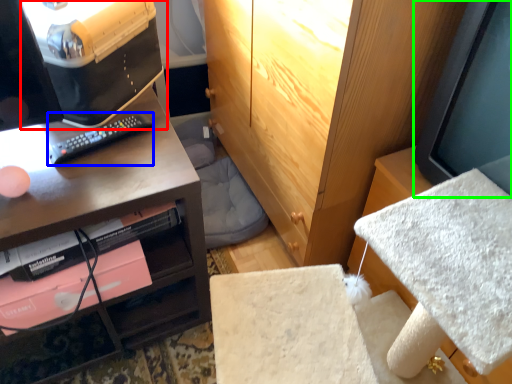
Question: Which object is the closest to the desktop computer (highlighted by a red box)? Choose among these: remote (highlighted by a blue box) or computer monitor (highlighted by a green box).

Choices:
 (A) remote
 (B) computer monitor

Answer: (A)